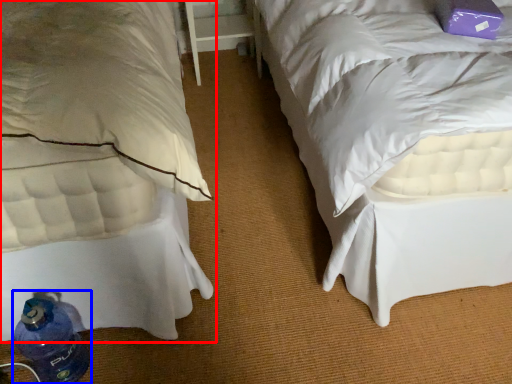
Question: Which object is closer to the camera taking this photo, bed (highlighted by a red box) or bottle (highlighted by a blue box)?

Choices:
 (A) bed
 (B) bottle

Answer: (A)